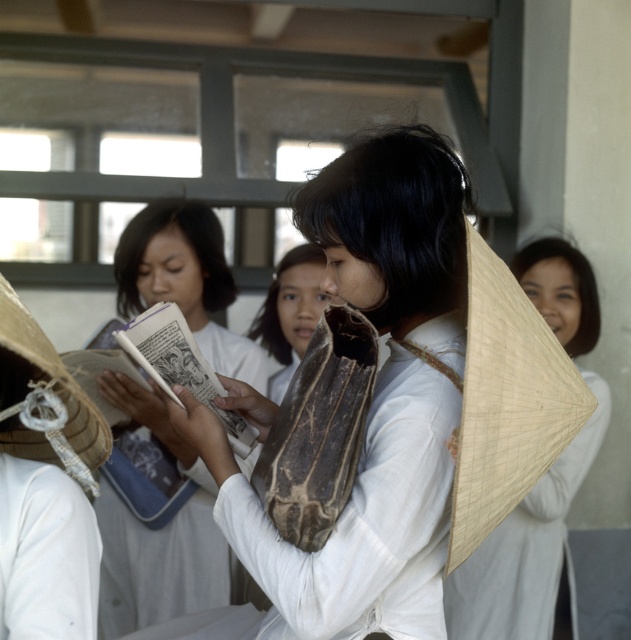
Question: Among these objects, which one is nearest to the camera?

Choices:
 (A) natural straw hat at left
 (B) white cotton ao dai at center
 (C) natural straw hat at center
 (D) white paper book at center

Answer: (A)

Question: Is white paper book at center further to camera compared to white cotton ao dai at center?

Choices:
 (A) yes
 (B) no

Answer: (B)

Question: Which point is closer to the camera taking this photo?

Choices:
 (A) (251, 336)
 (B) (563, 525)
 (C) (30, 420)

Answer: (C)

Question: Estimate the real-world distances between objects in this image. Which object is closer to the matte brown bag at center?

Choices:
 (A) natural straw hat at center
 (B) natural straw hat at left
 (C) white paper book at center
 (D) white cotton ao dai at center

Answer: (B)

Question: Can you confirm if matte brown bag at center is positioned to the left of natural straw hat at left?

Choices:
 (A) no
 (B) yes

Answer: (A)

Question: From the image, what is the correct spatial relationship of white paper book at center in relation to natural straw hat at left?

Choices:
 (A) left
 (B) right

Answer: (A)